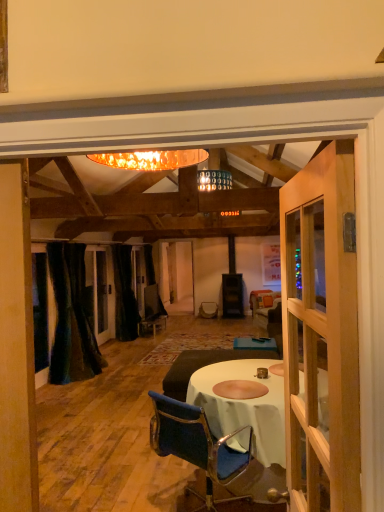
Question: Is velvet dark brown couch at center at the back of black velvet curtain at center, the 2th curtain in the front-to-back sequence?

Choices:
 (A) yes
 (B) no

Answer: (B)

Question: Are black velvet curtain at center, the 2th curtain in the front-to-back sequence, and velvet dark brown couch at center beside each other?

Choices:
 (A) yes
 (B) no

Answer: (B)

Question: Can you confirm if black velvet curtain at center, which ranks as the first curtain in back-to-front order, is taller than velvet dark brown couch at center?

Choices:
 (A) yes
 (B) no

Answer: (A)

Question: From the image's perspective, is black velvet curtain at center, the 2th curtain in the front-to-back sequence, located beneath velvet dark brown couch at center?

Choices:
 (A) yes
 (B) no

Answer: (B)

Question: From a real-world perspective, is black velvet curtain at center, the 2th curtain in the front-to-back sequence, physically below velvet dark brown couch at center?

Choices:
 (A) yes
 (B) no

Answer: (B)

Question: From their relative heights in the image, would you say wooden door at right is taller or shorter than black velvet curtain at center, which ranks as the first curtain in back-to-front order?

Choices:
 (A) short
 (B) tall

Answer: (A)

Question: Considering their positions, is wooden door at right located in front of or behind black velvet curtain at center, the 2th curtain in the front-to-back sequence?

Choices:
 (A) behind
 (B) front

Answer: (B)

Question: Considering the relative positions of wooden door at right and black velvet curtain at center, which ranks as the first curtain in back-to-front order, in the image provided, is wooden door at right to the left or to the right of black velvet curtain at center, which ranks as the first curtain in back-to-front order,?

Choices:
 (A) right
 (B) left

Answer: (A)

Question: Looking at the image, does wooden door at right seem bigger or smaller compared to black velvet curtain at center, the 2th curtain in the front-to-back sequence?

Choices:
 (A) big
 (B) small

Answer: (B)

Question: Do you think velvet dark brown couch at center is within velvet blue chair at center, or outside of it?

Choices:
 (A) outside
 (B) inside

Answer: (A)

Question: Considering the positions of velvet dark brown couch at center and velvet blue chair at center in the image, is velvet dark brown couch at center wider or thinner than velvet blue chair at center?

Choices:
 (A) thin
 (B) wide

Answer: (B)

Question: From a real-world perspective, is velvet dark brown couch at center above or below velvet blue chair at center?

Choices:
 (A) above
 (B) below

Answer: (B)

Question: Is velvet dark brown couch at center taller or shorter than velvet blue chair at center?

Choices:
 (A) tall
 (B) short

Answer: (B)

Question: Considering their positions, is velvet blue chair at center located in front of or behind velvet dark green curtain at left, marked as the 1th curtain in a front-to-back arrangement?

Choices:
 (A) front
 (B) behind

Answer: (A)

Question: Is velvet blue chair at center situated inside velvet dark green curtain at left, which is the 2th curtain in back-to-front order, or outside?

Choices:
 (A) inside
 (B) outside

Answer: (B)